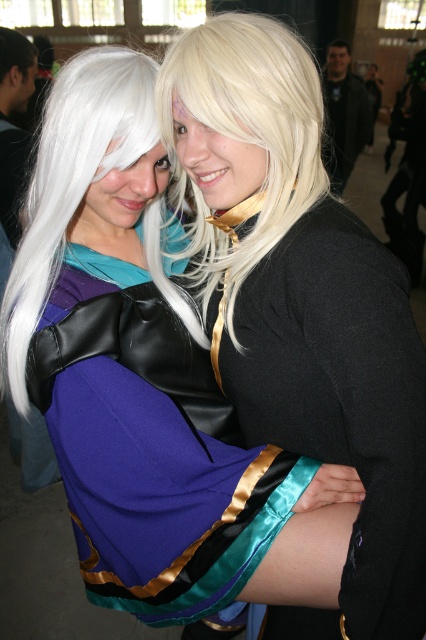
Question: Which object is farther from the camera taking this photo?

Choices:
 (A) blonde silky hair at upper center
 (B) satin black dress at center

Answer: (A)

Question: Is satin black dress at center to the right of blonde silky hair at upper center from the viewer's perspective?

Choices:
 (A) yes
 (B) no

Answer: (A)

Question: Which point is closer to the camera?

Choices:
 (A) (126, 99)
 (B) (121, 284)
 (C) (239, 259)
 (D) (336, 616)

Answer: (A)

Question: Observing the image, what is the correct spatial positioning of blonde silky hair at upper center in reference to white silky wig at left?

Choices:
 (A) left
 (B) right

Answer: (B)

Question: Can you confirm if satin black dress at center is bigger than white silky wig at left?

Choices:
 (A) no
 (B) yes

Answer: (B)

Question: Which of the following is the farthest from the observer?

Choices:
 (A) (282, 67)
 (B) (2, 368)
 (C) (252, 458)

Answer: (B)